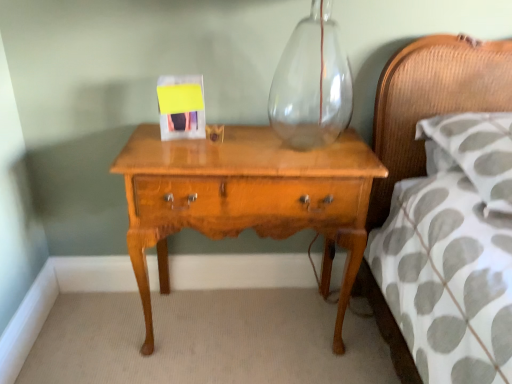
The height and width of the screenshot is (384, 512). In order to click on vacant space that is to the left of light brown wood nightstand at center in this screenshot , I will do `click(97, 334)`.